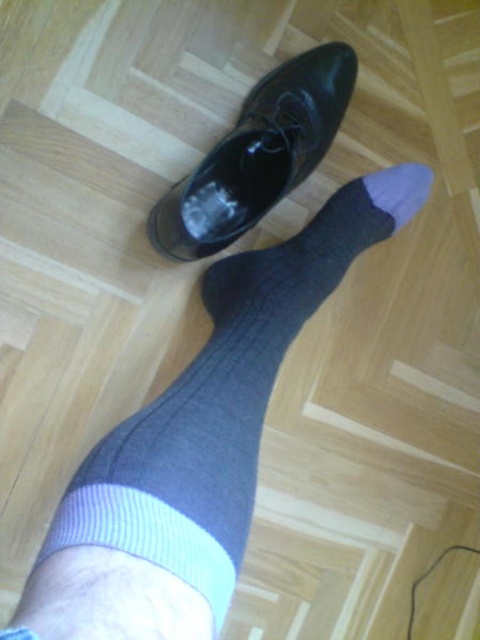
You are a fashion designer examining a model wearing both the shiny black shoe at center and the gray knitted sock at center. Which item is covering the other?

The shiny black shoe at center is positioned over the gray knitted sock at center, so it is covering the sock.

You are trying to put on a pair of socks and a shoe. You have two socks in front of you, a gray ribbed sock at center and a gray knitted sock at center. Which sock should you put on first based on their widths?

The gray ribbed sock at center is wider than the gray knitted sock at center, so you should put on the gray knitted sock at center first to ensure it fits properly inside the shoe.

You are trying to put on your shiny black shoe at center and gray knitted sock at center. Which item should you put on first based on their current positions?

The gray knitted sock at center should be put on first because the shiny black shoe at center is positioned on its left side, indicating it is already placed over the sock.